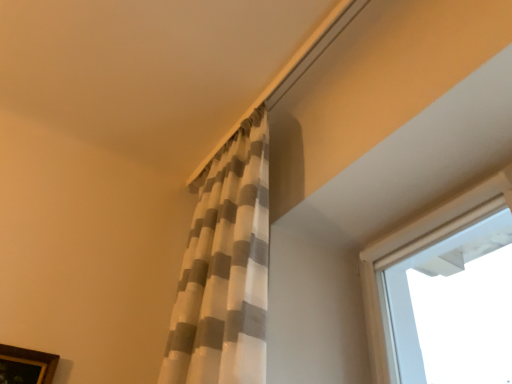
Question: Is white textured curtain at upper center spatially inside brown wooden picture frame at lower left, or outside of it?

Choices:
 (A) outside
 (B) inside

Answer: (A)

Question: Is white textured curtain at upper center taller or shorter than brown wooden picture frame at lower left?

Choices:
 (A) short
 (B) tall

Answer: (B)

Question: From a real-world perspective, is white textured curtain at upper center positioned above or below brown wooden picture frame at lower left?

Choices:
 (A) below
 (B) above

Answer: (B)

Question: From the image's perspective, relative to white textured curtain at upper center, is brown wooden picture frame at lower left above or below?

Choices:
 (A) below
 (B) above

Answer: (A)

Question: Do you think brown wooden picture frame at lower left is within white textured curtain at upper center, or outside of it?

Choices:
 (A) outside
 (B) inside

Answer: (A)

Question: Considering the positions of brown wooden picture frame at lower left and white textured curtain at upper center in the image, is brown wooden picture frame at lower left wider or thinner than white textured curtain at upper center?

Choices:
 (A) thin
 (B) wide

Answer: (A)

Question: Considering their positions, is brown wooden picture frame at lower left located in front of or behind white textured curtain at upper center?

Choices:
 (A) behind
 (B) front

Answer: (A)